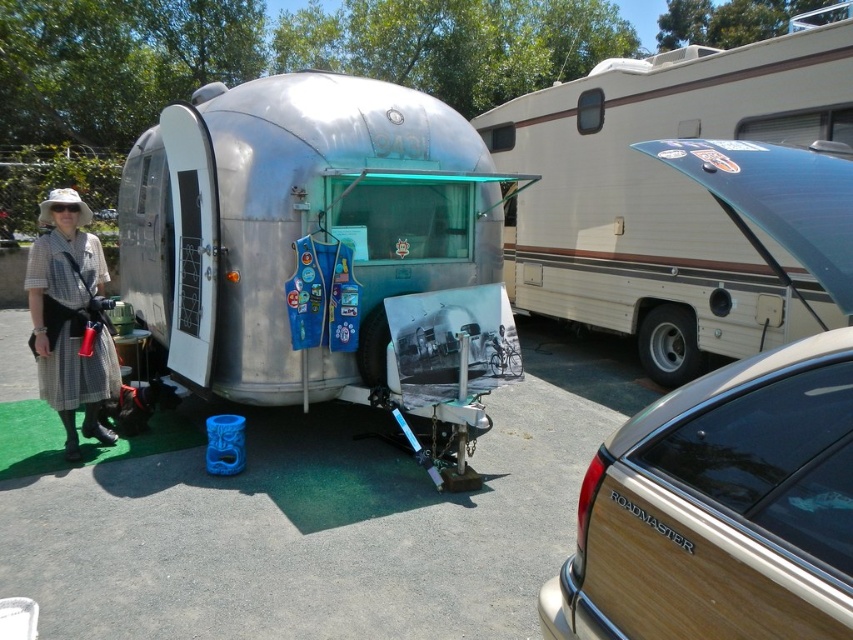
You are standing in front of the shiny aluminum trailer at center and want to greet the person wearing the checkered fabric dress at lower left. In which direction should you walk to reach them?

The shiny aluminum trailer at center is to the right of the checkered fabric dress at lower left, so you should walk to the left to reach the person wearing the checkered fabric dress at lower left.

You are planning to set up a picnic blanket between the beige vinyl recreational vehicle at upper right and the checkered fabric dress at lower left. The picnic blanket requires 15 feet of space. Is there enough space between them to accommodate it?

The beige vinyl recreational vehicle at upper right is 19.40 feet from the checkered fabric dress at lower left, which is more than the required 15 feet. Therefore, there is sufficient space to set up the picnic blanket between them.